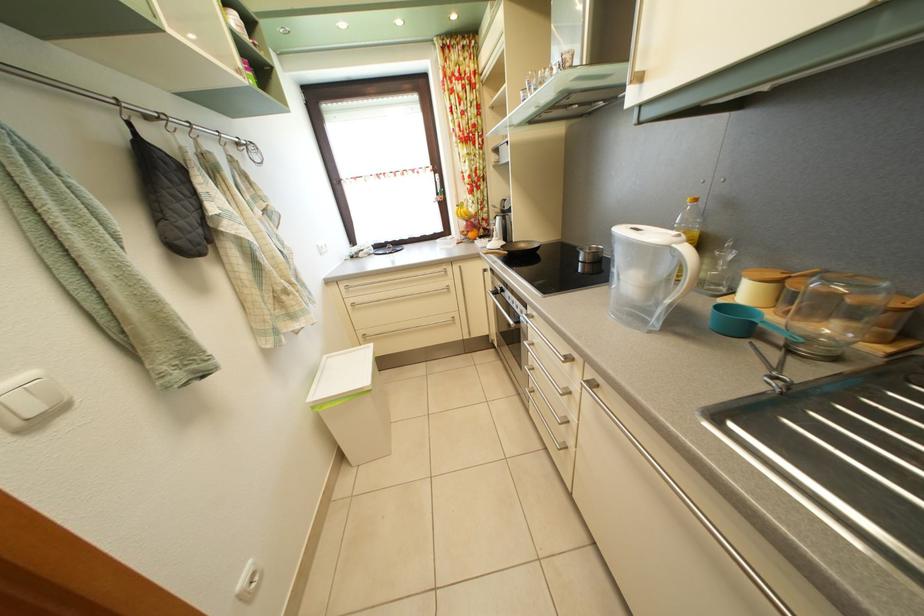
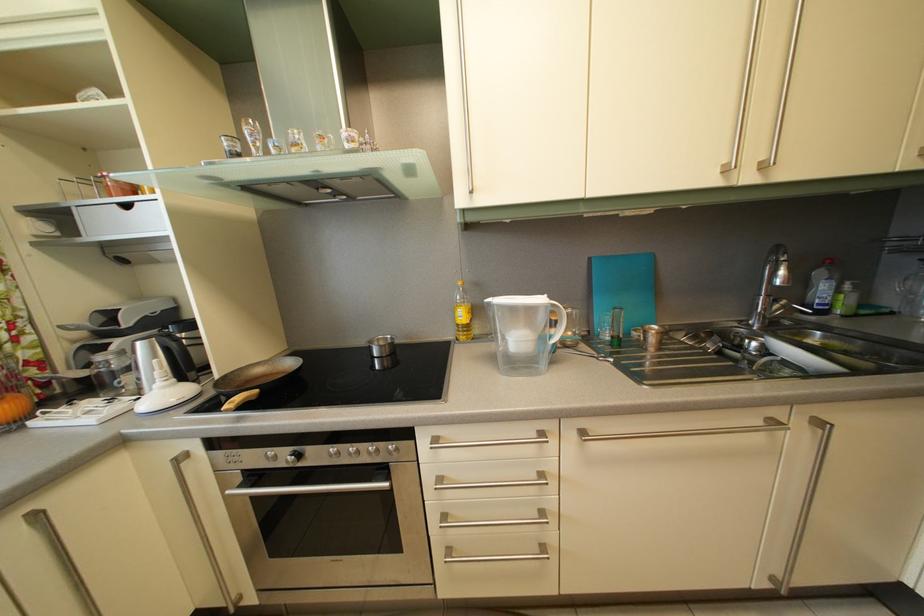
Question: The first image is from the beginning of the video and the second image is from the end. How did the camera likely rotate when shooting the video?

Choices:
 (A) Left
 (B) Right
 (C) Up
 (D) Down

Answer: (B)